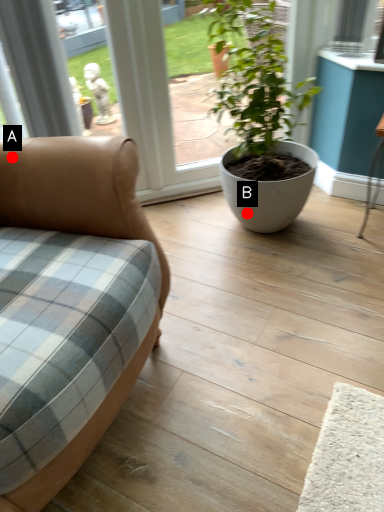
Question: Two points are circled on the image, labeled by A and B beside each circle. Which of the following is the closest to the observer?

Choices:
 (A) A is closer
 (B) B is closer

Answer: (A)